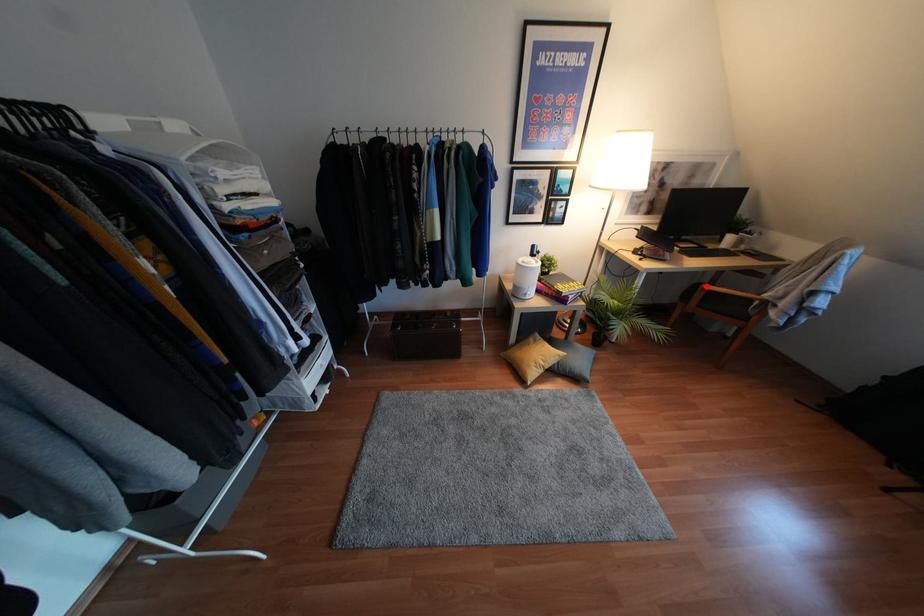
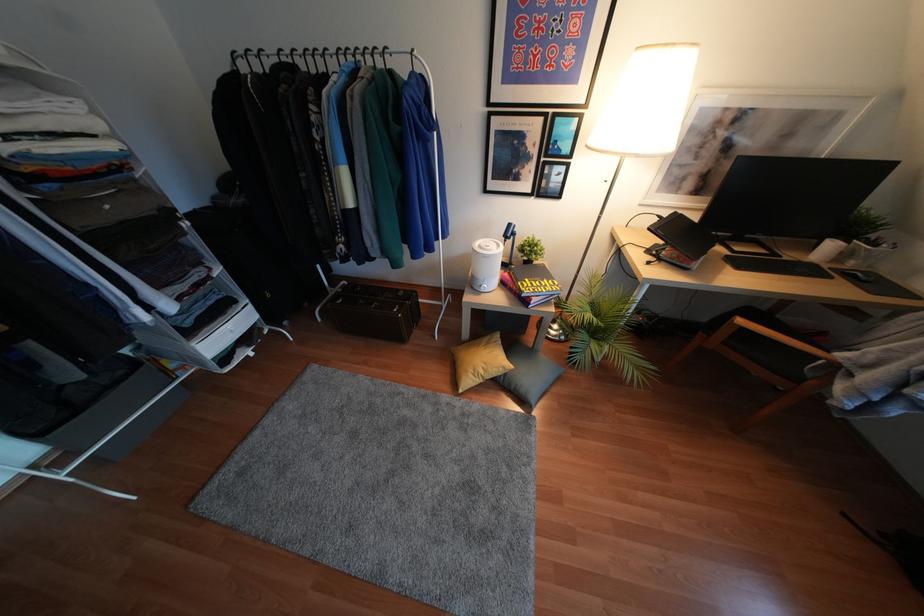
Question: I am providing you with two images of the same scene from different viewpoints. In image1, a red point is highlighted. Considering the same 3D point in image2, which of the following is correct?

Choices:
 (A) It is closer
 (B) It is farther

Answer: (B)